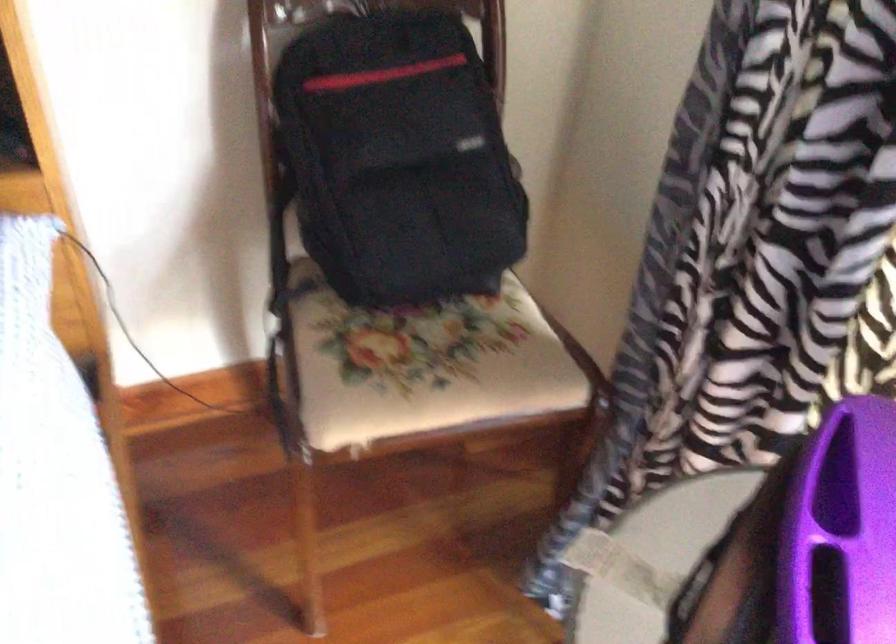
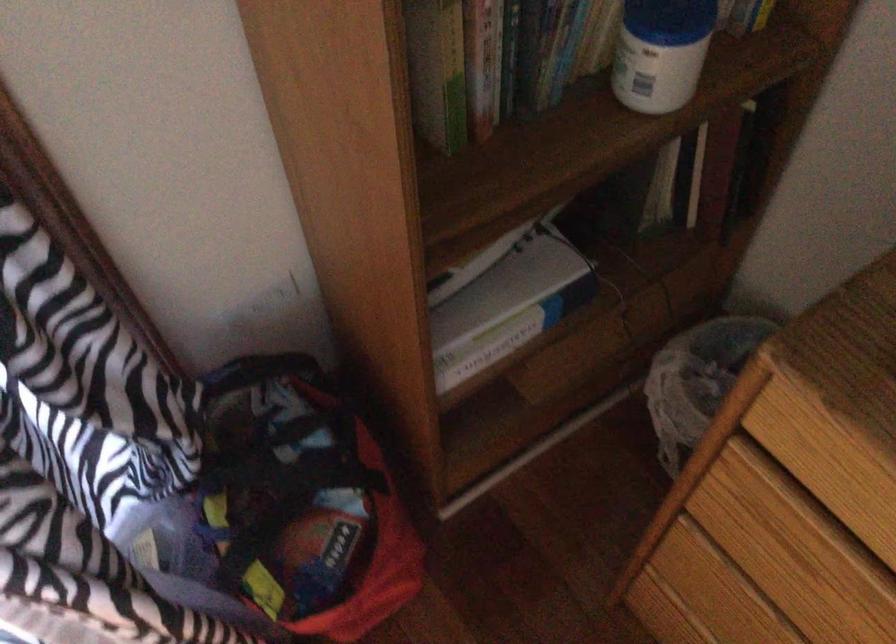
The first image is from the beginning of the video and the second image is from the end. How did the camera likely rotate when shooting the video?

The camera's rotation is toward right-down.